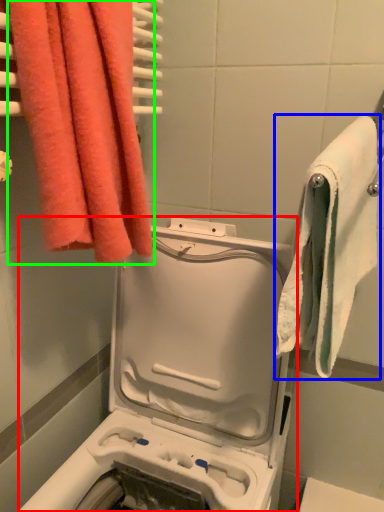
Question: Considering the real-world distances, which object is closest to washing machine (highlighted by a red box)? towel (highlighted by a blue box) or towel (highlighted by a green box).

Choices:
 (A) towel
 (B) towel

Answer: (A)